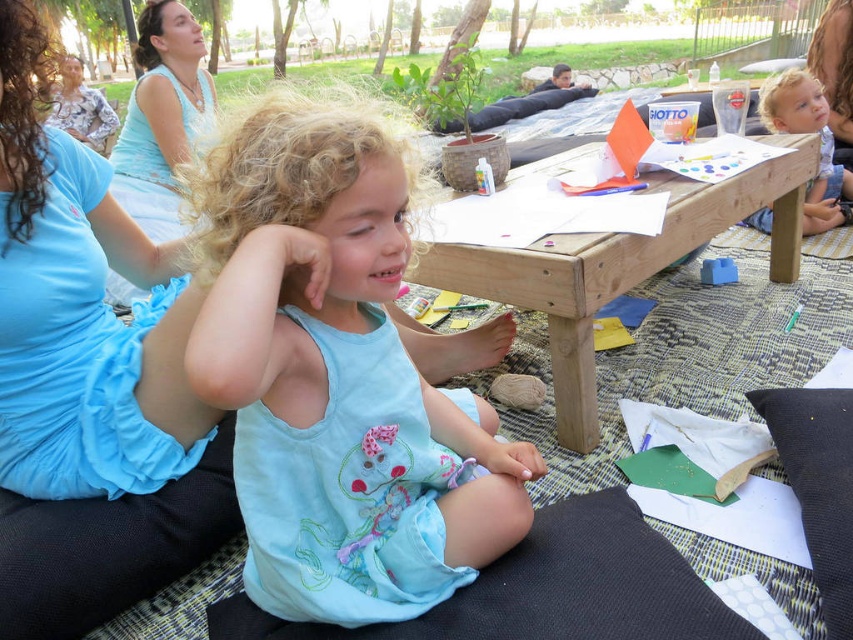
You are a photographer trying to capture a clear shot of the wooden picnic table at center and the floral fabric dress at upper left. Since the dress is partially obscured by something, can you adjust your position to see both objects clearly?

The wooden picnic table at center is in front of the floral fabric dress at upper left, so moving your position slightly to the side might allow you to see both objects without obstruction.

You are a parent who wants to set up a picnic blanket under the shade provided by the floral fabric dress at upper left. Can you place the wooden picnic table at center there without moving the dress?

The wooden picnic table at center is already positioned under the floral fabric dress at upper left, so you can place the picnic blanket there without moving the dress.